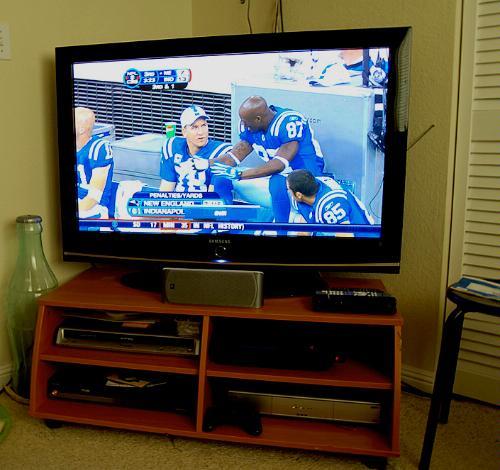
Image resolution: width=500 pixels, height=470 pixels. In order to click on tv screen in this screenshot , I will do [x=148, y=119].